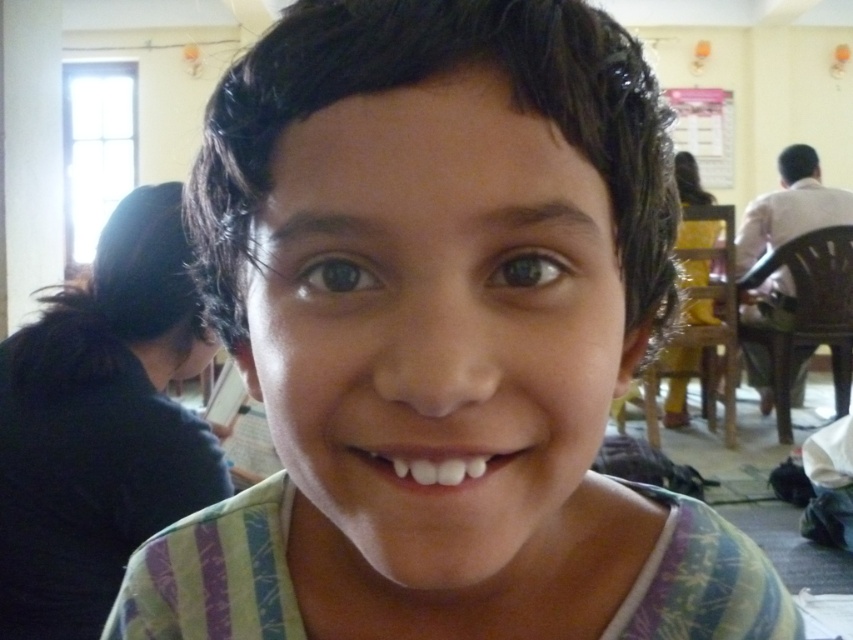
Question: Among these objects, which one is farthest from the camera?

Choices:
 (A) yellow fabric pants at right
 (B) white shirt at right
 (C) dark blue fabric at left

Answer: (B)

Question: Can you confirm if white shirt at right is bigger than yellow fabric pants at right?

Choices:
 (A) yes
 (B) no

Answer: (A)

Question: Does dark blue fabric at left have a greater width compared to white shirt at right?

Choices:
 (A) yes
 (B) no

Answer: (B)

Question: Is yellow fabric pants at right smaller than white glossy teeth at center?

Choices:
 (A) yes
 (B) no

Answer: (B)

Question: Which object is the closest to the dark blue fabric at left?

Choices:
 (A) white glossy teeth at center
 (B) yellow fabric pants at right
 (C) white shirt at right

Answer: (A)

Question: Estimate the real-world distances between objects in this image. Which object is closer to the white shirt at right?

Choices:
 (A) yellow fabric pants at right
 (B) dark blue fabric at left
 (C) white glossy teeth at center

Answer: (A)